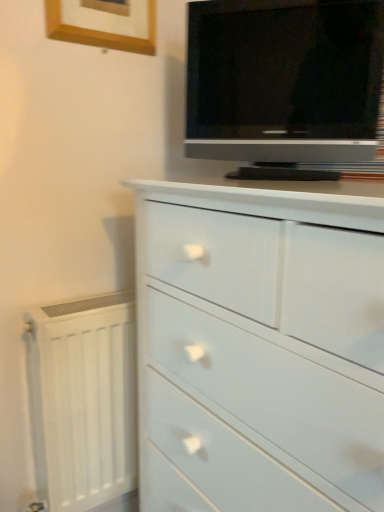
Question: Is matte black tv at upper right oriented away from white painted radiator at lower left?

Choices:
 (A) no
 (B) yes

Answer: (A)

Question: Is matte black tv at upper right facing towards white painted radiator at lower left?

Choices:
 (A) yes
 (B) no

Answer: (B)

Question: Can white painted radiator at lower left be found inside matte black tv at upper right?

Choices:
 (A) yes
 (B) no

Answer: (B)

Question: Considering the relative positions of matte black tv at upper right and white painted radiator at lower left in the image provided, is matte black tv at upper right to the left of white painted radiator at lower left from the viewer's perspective?

Choices:
 (A) no
 (B) yes

Answer: (A)

Question: Considering the relative sizes of matte black tv at upper right and white painted radiator at lower left in the image provided, is matte black tv at upper right bigger than white painted radiator at lower left?

Choices:
 (A) no
 (B) yes

Answer: (A)

Question: From a real-world perspective, is matte black tv at upper right beneath white painted radiator at lower left?

Choices:
 (A) no
 (B) yes

Answer: (A)

Question: Does white painted radiator at lower left have a greater height compared to matte black tv at upper right?

Choices:
 (A) yes
 (B) no

Answer: (A)

Question: Does white painted radiator at lower left have a larger size compared to matte black tv at upper right?

Choices:
 (A) no
 (B) yes

Answer: (B)

Question: Is white painted radiator at lower left oriented towards matte black tv at upper right?

Choices:
 (A) no
 (B) yes

Answer: (A)

Question: Does white painted radiator at lower left have a lesser height compared to matte black tv at upper right?

Choices:
 (A) yes
 (B) no

Answer: (B)

Question: Is white painted radiator at lower left outside matte black tv at upper right?

Choices:
 (A) no
 (B) yes

Answer: (B)

Question: Is white painted radiator at lower left smaller than matte black tv at upper right?

Choices:
 (A) yes
 (B) no

Answer: (B)

Question: Can you confirm if wooden picture frame at upper left is bigger than matte black tv at upper right?

Choices:
 (A) yes
 (B) no

Answer: (B)